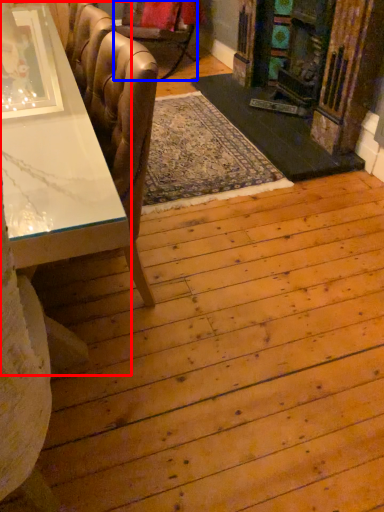
Question: Which object is closer to the camera taking this photo, table (highlighted by a red box) or chair (highlighted by a blue box)?

Choices:
 (A) table
 (B) chair

Answer: (A)